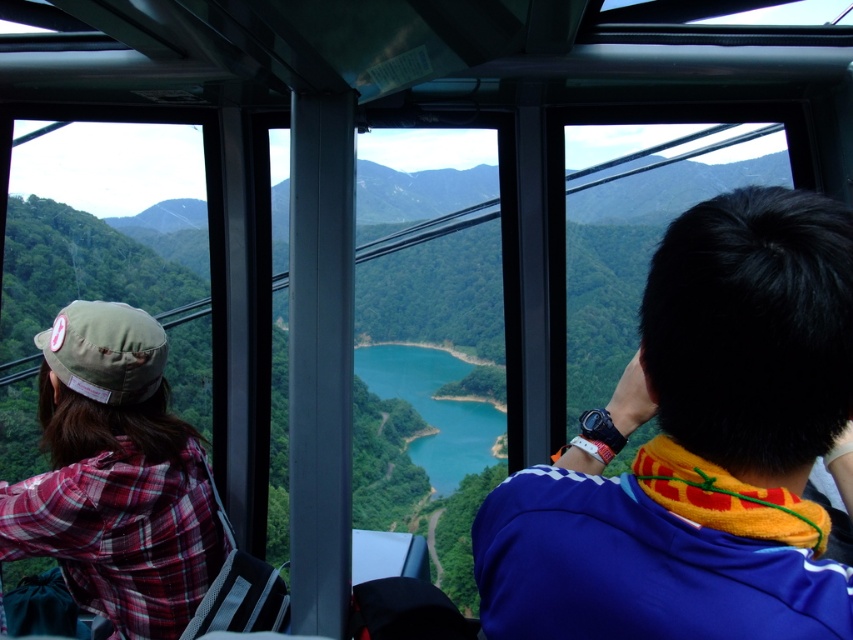
Question: Is blue fabric jacket at center bigger than plaid fabric shirt at left?

Choices:
 (A) no
 (B) yes

Answer: (A)

Question: Among these points, which one is farthest from the camera?

Choices:
 (A) (85, 410)
 (B) (659, 260)

Answer: (A)

Question: Which object is closer to the camera taking this photo?

Choices:
 (A) plaid fabric shirt at left
 (B) blue fabric jacket at center

Answer: (B)

Question: Does blue fabric jacket at center come behind plaid fabric shirt at left?

Choices:
 (A) yes
 (B) no

Answer: (B)

Question: Which of the following is the farthest from the observer?

Choices:
 (A) click(726, 577)
 (B) click(169, 420)

Answer: (B)

Question: Does blue fabric jacket at center come behind plaid fabric shirt at left?

Choices:
 (A) no
 (B) yes

Answer: (A)